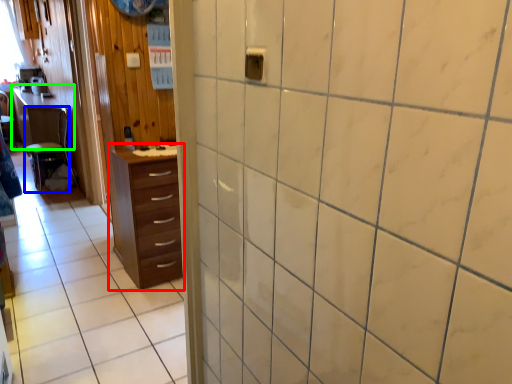
Question: Based on their relative distances, which object is farther from chest of drawers (highlighted by a red box)? Choose from furniture (highlighted by a blue box) and table (highlighted by a green box).

Choices:
 (A) furniture
 (B) table

Answer: (B)